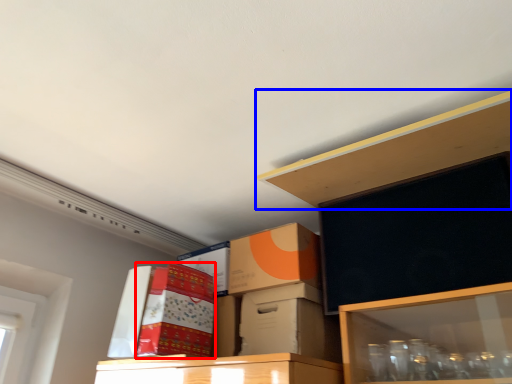
Question: Which of the following is the closest to the observer, storage box (highlighted by a red box) or shelf (highlighted by a blue box)?

Choices:
 (A) storage box
 (B) shelf

Answer: (B)